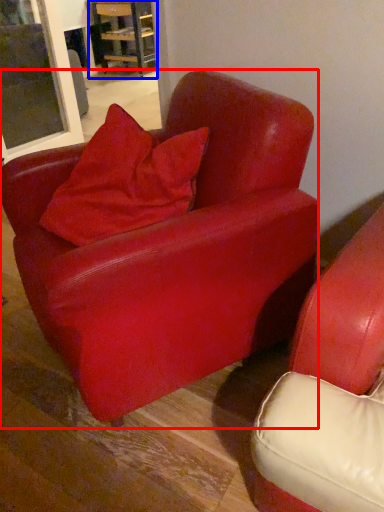
Question: Which point is closer to the camera, chair (highlighted by a red box) or table (highlighted by a blue box)?

Choices:
 (A) chair
 (B) table

Answer: (A)